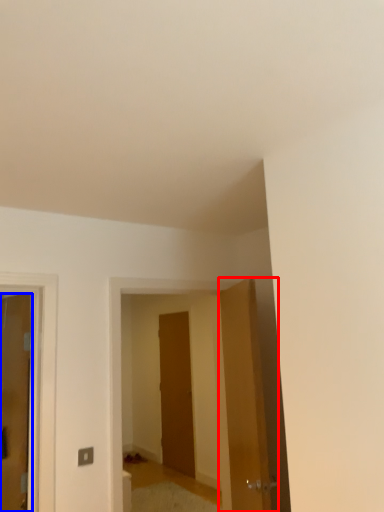
Question: Which of the following is the closest to the observer, door (highlighted by a red box) or door (highlighted by a blue box)?

Choices:
 (A) door
 (B) door

Answer: (A)